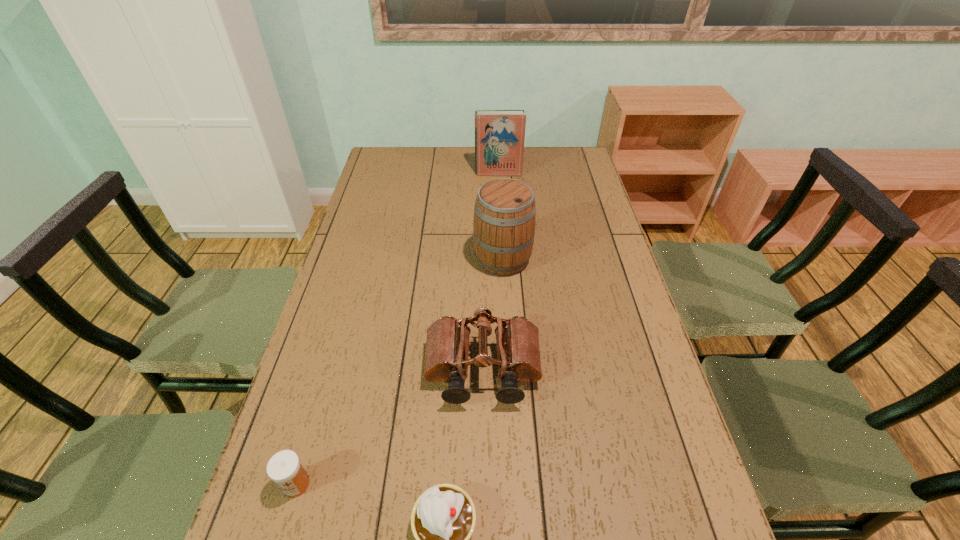
This screenshot has width=960, height=540. I want to click on object positioned at the left edge, so click(284, 468).

Where is `free location at the far edge of the desktop`? This screenshot has width=960, height=540. free location at the far edge of the desktop is located at coordinates click(x=437, y=159).

The image size is (960, 540). In the image, there is a desktop. Identify the location of free space at the left edge. (374, 255).

Where is `vacant area at the right edge of the desktop`? The image size is (960, 540). vacant area at the right edge of the desktop is located at coordinates [634, 320].

Identify the location of vacant space in between the leftmost object and the fourth nearest object. Image resolution: width=960 pixels, height=540 pixels. (399, 372).

Where is `free point between the binoculars and the leftmost object`? free point between the binoculars and the leftmost object is located at coordinates (390, 428).

Identify the location of free area in between the third farthest object and the medicine. (390, 428).

I want to click on object that is the fourth closest one to the cider, so click(x=284, y=468).

Identify which object is the second nearest to the leftmost object. Please provide its 2D coordinates. Your answer should be formatted as a tuple, i.e. [(x, y)], where the tuple contains the x and y coordinates of a point satisfying the conditions above.

[(447, 346)]